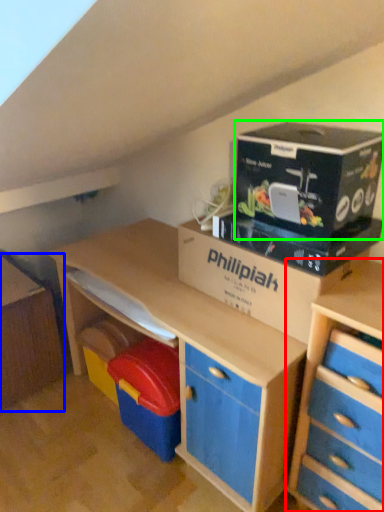
Question: Estimate the real-world distances between objects in this image. Which object is farther from chest of drawers (highlighted by a red box), file cabinet (highlighted by a blue box) or cardboard (highlighted by a green box)?

Choices:
 (A) file cabinet
 (B) cardboard

Answer: (A)